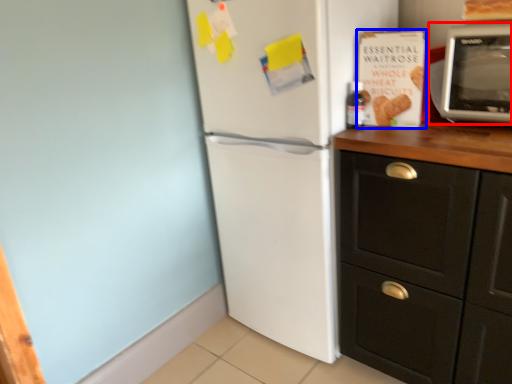
Question: Which of the following is the farthest to the observer, microwave oven (highlighted by a red box) or magazine (highlighted by a blue box)?

Choices:
 (A) microwave oven
 (B) magazine

Answer: (B)